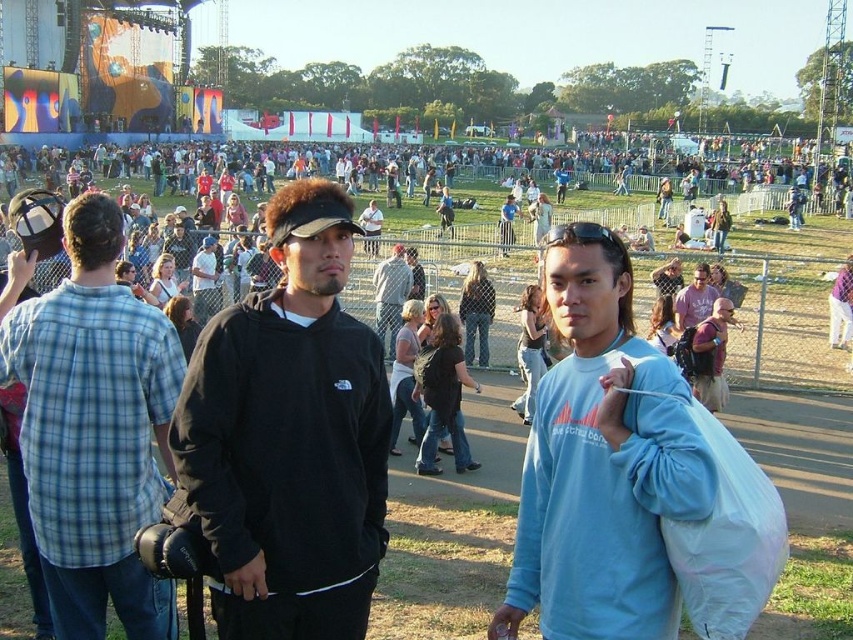
You are organizing a charity clothing drive and need to decide which item to place in a donation bin that can only accommodate one of the two items. Based on their sizes, which item between the black matte sweatshirt at center and the black fabric jacket at center should you choose to ensure it fits?

The black matte sweatshirt at center is bigger than the black fabric jacket at center, so you should choose the black fabric jacket at center to ensure it fits in the donation bin.

You are a photographer at the music festival. You need to capture both the light blue sweatshirt at center and the blue plaid shirt at left in your shot. Which clothing item should you focus on first to ensure it fits in the frame?

The light blue sweatshirt at center is bigger than the blue plaid shirt at left, so you should focus on capturing the light blue sweatshirt at center first to ensure it fits within the frame.